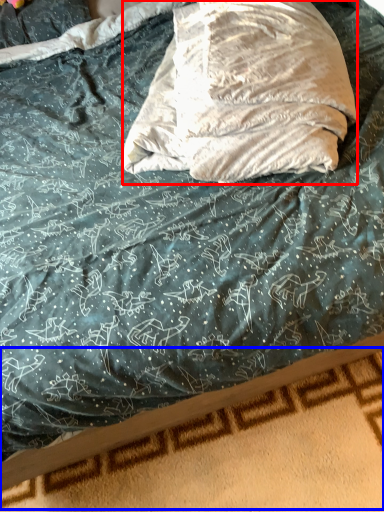
Question: Which of the following is the farthest to the observer, throw pillow (highlighted by a red box) or bed frame (highlighted by a blue box)?

Choices:
 (A) throw pillow
 (B) bed frame

Answer: (B)